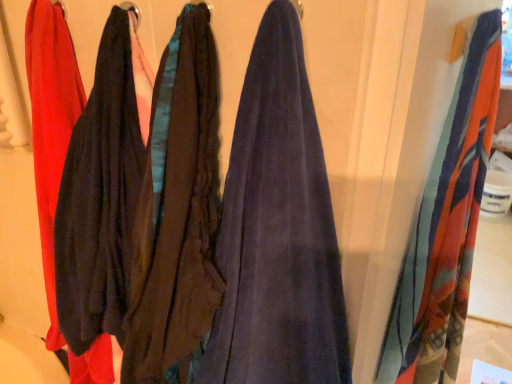
Question: From the image's perspective, relative to printed silk scarf at right, is matte black fabric at left above or below?

Choices:
 (A) above
 (B) below

Answer: (A)

Question: Is matte black fabric at left taller or shorter than printed silk scarf at right?

Choices:
 (A) short
 (B) tall

Answer: (A)

Question: Looking at the image, does matte black fabric at left seem bigger or smaller compared to printed silk scarf at right?

Choices:
 (A) small
 (B) big

Answer: (A)

Question: Is printed silk scarf at right taller or shorter than matte black fabric at left?

Choices:
 (A) short
 (B) tall

Answer: (B)

Question: Is printed silk scarf at right bigger or smaller than matte black fabric at left?

Choices:
 (A) small
 (B) big

Answer: (B)

Question: Based on their positions, is printed silk scarf at right located to the left or right of matte black fabric at left?

Choices:
 (A) left
 (B) right

Answer: (B)

Question: From a real-world perspective, is printed silk scarf at right positioned above or below matte black fabric at left?

Choices:
 (A) above
 (B) below

Answer: (B)